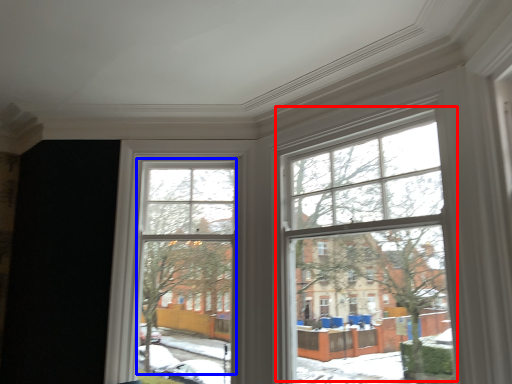
Question: Among these objects, which one is farthest to the camera, bay window (highlighted by a red box) or bay window (highlighted by a blue box)?

Choices:
 (A) bay window
 (B) bay window

Answer: (B)